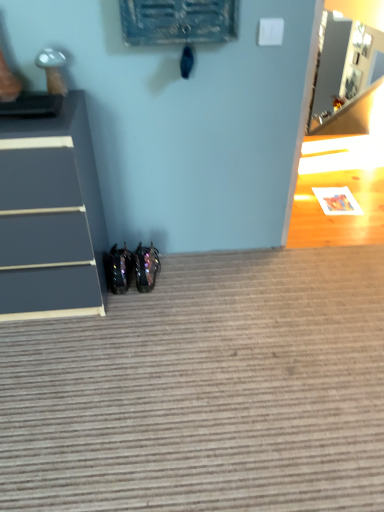
Image resolution: width=384 pixels, height=512 pixels. I want to click on spots to the right of glossy black shoes at lower center, which is the 2th footwear from right to left, so click(173, 274).